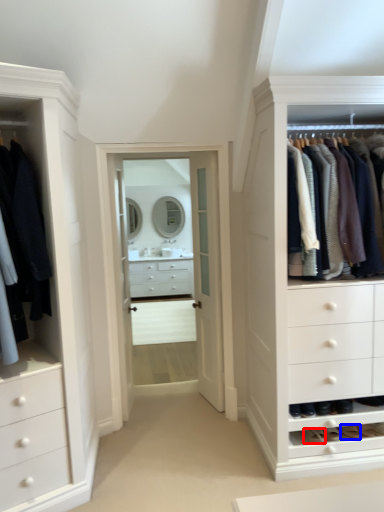
Question: Which point is further to the camera, shoe (highlighted by a red box) or shoe (highlighted by a blue box)?

Choices:
 (A) shoe
 (B) shoe

Answer: (B)